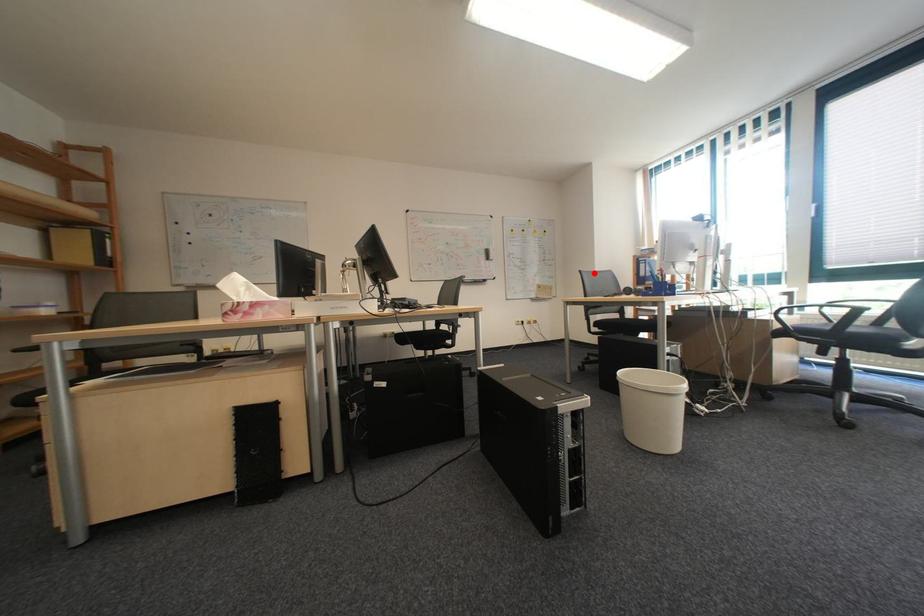
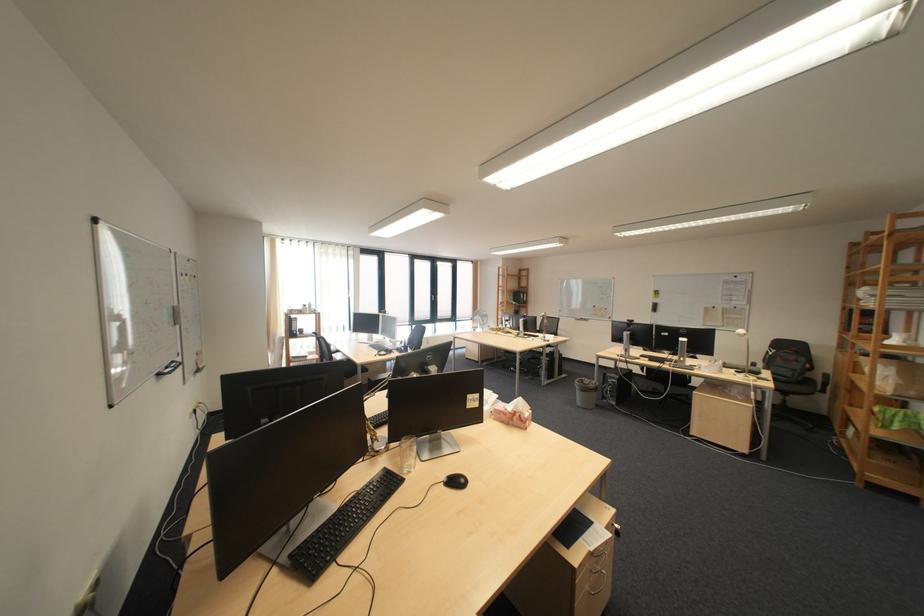
Question: I am providing you with two images of the same scene from different viewpoints. A red point is marked on the first image. Is the red point's position out of view in image 2?

Choices:
 (A) Yes
 (B) No

Answer: (A)